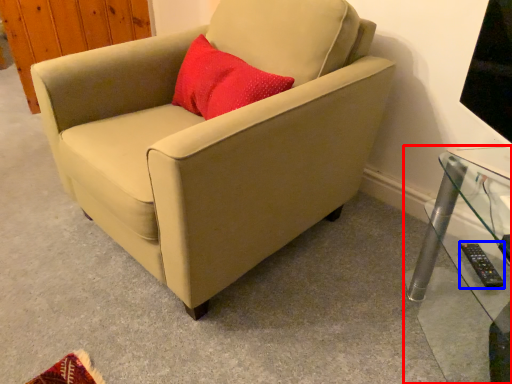
Question: Among these objects, which one is nearest to the camera, table (highlighted by a red box) or remote (highlighted by a blue box)?

Choices:
 (A) table
 (B) remote

Answer: (A)